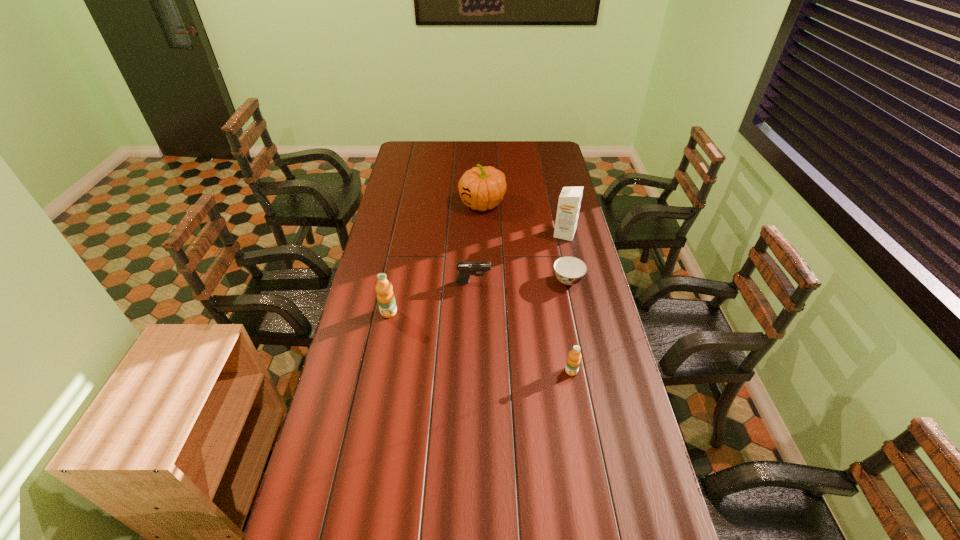
Find the location of a particular element. This screenshot has height=540, width=960. free space at the far edge of the desktop is located at coordinates (523, 155).

In the image, there is a desktop. Where is `vacant space at the near edge`? vacant space at the near edge is located at coordinates (506, 504).

In the image, there is a desktop. Where is `blank space at the left edge`? blank space at the left edge is located at coordinates [x=403, y=215].

In order to click on vacant space at the right edge of the desktop in this screenshot , I will do `click(557, 245)`.

Where is `unoccupied position between the pumpkin and the soup bowl`? This screenshot has height=540, width=960. unoccupied position between the pumpkin and the soup bowl is located at coordinates (525, 242).

Where is `empty space between the farthest object and the pistol`? This screenshot has width=960, height=540. empty space between the farthest object and the pistol is located at coordinates (478, 243).

The width and height of the screenshot is (960, 540). Find the location of `vacant space in between the farthest object and the farther orange juice`. vacant space in between the farthest object and the farther orange juice is located at coordinates (436, 258).

Identify the location of free space between the fifth tallest object and the farthest object. (478, 243).

Find the location of a particular element. This screenshot has width=960, height=540. vacant area that lies between the pistol and the carton is located at coordinates (519, 258).

Where is `vacant space in between the pumpkin and the shortest object`? vacant space in between the pumpkin and the shortest object is located at coordinates (525, 242).